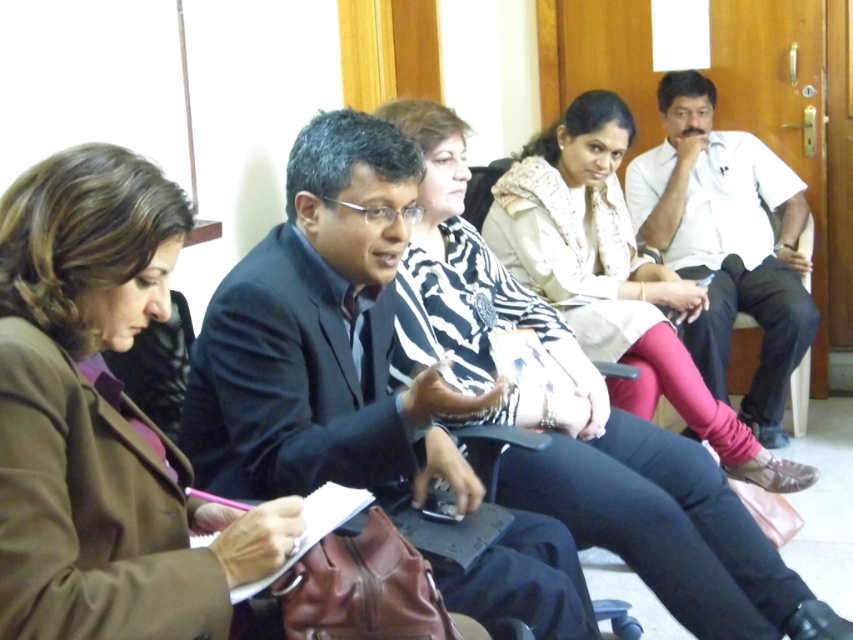
Question: Does brown leather jacket at left come behind white cotton shirt at right?

Choices:
 (A) yes
 (B) no

Answer: (B)

Question: Which point is farther to the camera?

Choices:
 (A) (299, 472)
 (B) (134, 296)
 (C) (434, 148)
 (D) (737, 264)

Answer: (D)

Question: Is dark suit at center below white cotton shirt at right?

Choices:
 (A) yes
 (B) no

Answer: (A)

Question: Is brown leather jacket at left to the left of dark suit at center from the viewer's perspective?

Choices:
 (A) no
 (B) yes

Answer: (B)

Question: Estimate the real-world distances between objects in this image. Which object is farther from the brown leather jacket at left?

Choices:
 (A) zebra print scarf at center
 (B) dark suit at center

Answer: (A)

Question: Estimate the real-world distances between objects in this image. Which object is closer to the brown leather jacket at left?

Choices:
 (A) zebra print scarf at center
 (B) dark suit at center
 (C) white cotton shirt at right

Answer: (B)